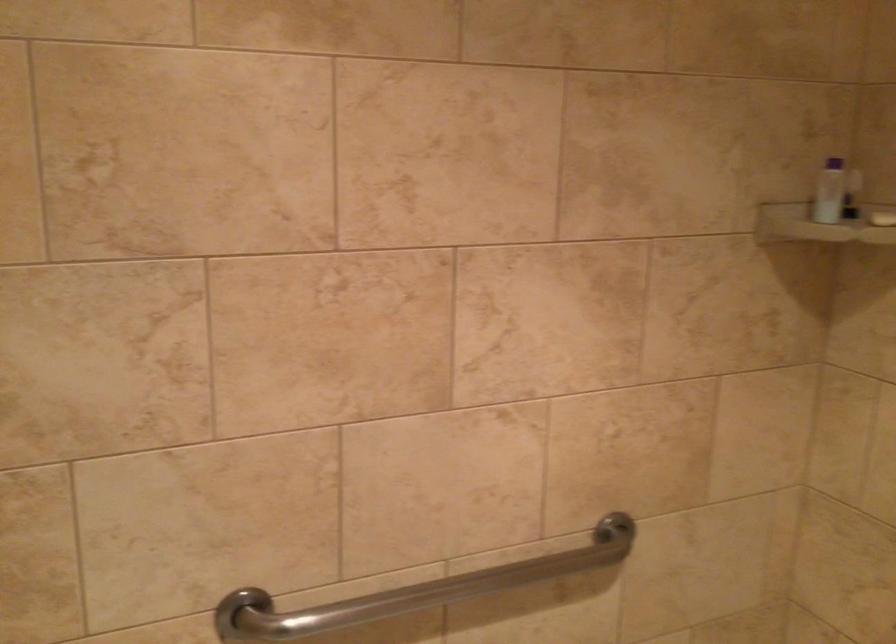
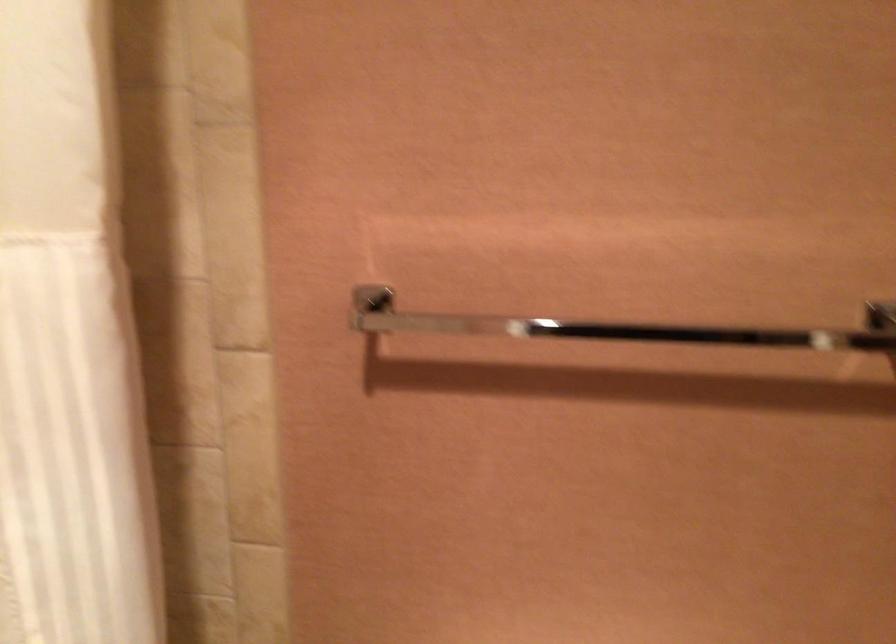
Question: The camera is either moving clockwise (left) or counter-clockwise (right) around the object. The first image is from the beginning of the video and the second image is from the end. Is the camera moving left or right when shooting the video?

Choices:
 (A) Left
 (B) Right

Answer: (A)